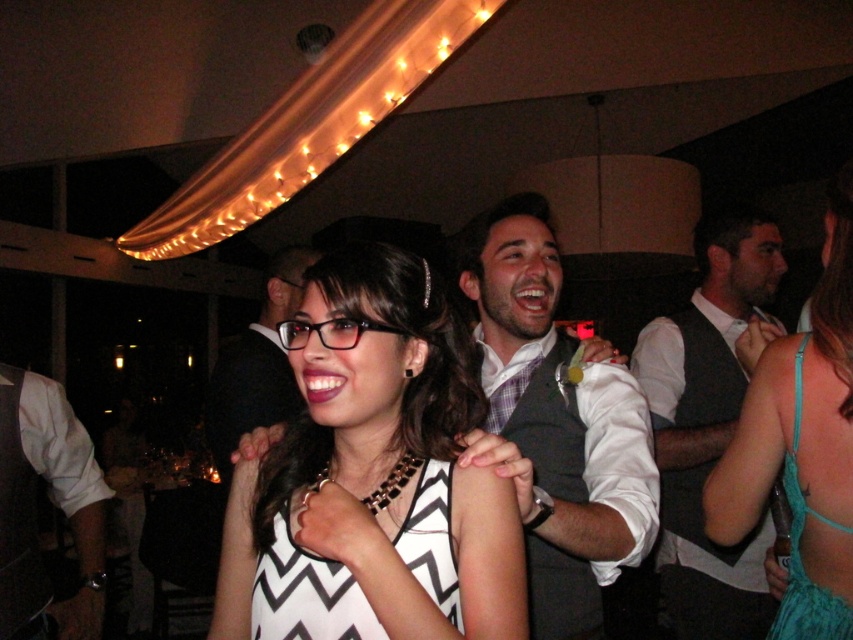
Consider the image. Is white zigzag dress at center shorter than black suit at center?

Yes.

Is the position of white zigzag dress at center less distant than that of black suit at center?

Yes, white zigzag dress at center is closer to the viewer.

Image resolution: width=853 pixels, height=640 pixels. What do you see at coordinates (372, 477) in the screenshot? I see `white zigzag dress at center` at bounding box center [372, 477].

Image resolution: width=853 pixels, height=640 pixels. What are the coordinates of `white zigzag dress at center` in the screenshot? It's located at (372, 477).

Who is more forward, (639,424) or (846,602)?

Positioned in front is point (846,602).

Where is `gray fabric vest at upper center`? The width and height of the screenshot is (853, 640). gray fabric vest at upper center is located at coordinates (556, 422).

Is teal satin dress at right closer to the viewer compared to black suit at center?

That is True.

This screenshot has height=640, width=853. What do you see at coordinates (801, 445) in the screenshot? I see `teal satin dress at right` at bounding box center [801, 445].

Is point (786, 456) less distant than point (233, 426)?

That is True.

Where is `teal satin dress at right`? This screenshot has height=640, width=853. teal satin dress at right is located at coordinates (801, 445).